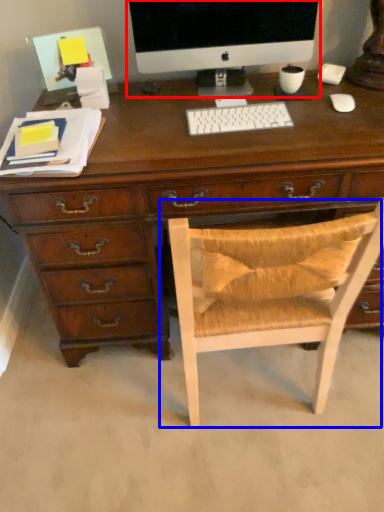
Question: Which object is closer to the camera taking this photo, computer monitor (highlighted by a red box) or chair (highlighted by a blue box)?

Choices:
 (A) computer monitor
 (B) chair

Answer: (B)